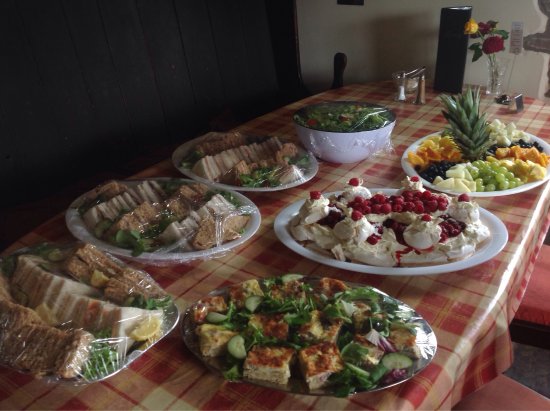
Identify the location of pepper shaker. This screenshot has height=411, width=550. [x=421, y=90].